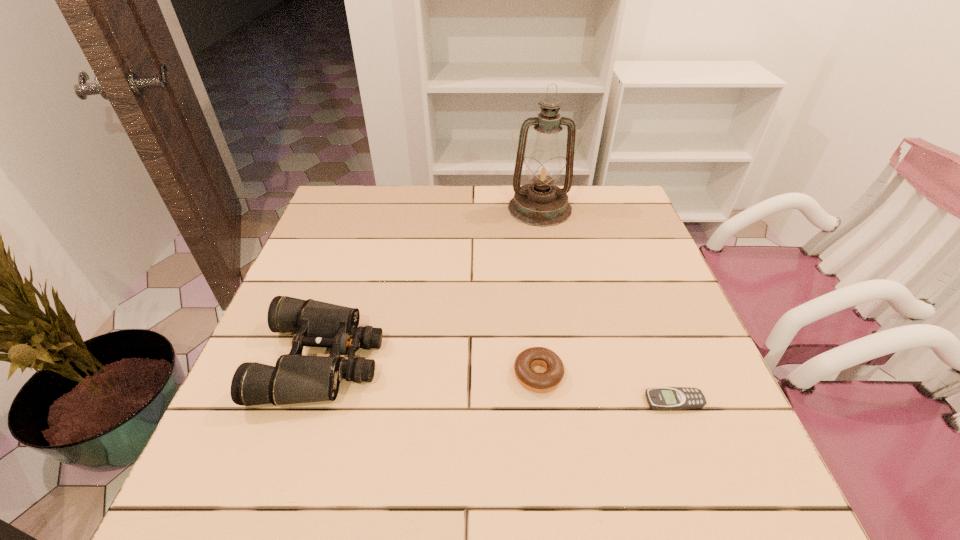
Where is `the tallest object`? This screenshot has height=540, width=960. the tallest object is located at coordinates (540, 203).

This screenshot has height=540, width=960. I want to click on the farthest object, so click(x=540, y=203).

The width and height of the screenshot is (960, 540). I want to click on binoculars, so click(x=296, y=378).

Identify the location of the third shortest object. tap(296, 378).

This screenshot has width=960, height=540. I want to click on the second shortest object, so click(x=537, y=382).

This screenshot has height=540, width=960. Identify the location of the shortest object. (663, 398).

Find the location of a particular element. This screenshot has width=960, height=540. the rightmost object is located at coordinates (663, 398).

Where is `free space located 0.350m on the front of the tallest object`? The height and width of the screenshot is (540, 960). free space located 0.350m on the front of the tallest object is located at coordinates (559, 313).

You are a GUI agent. You are given a task and a screenshot of the screen. Output one action in this format:
    pyautogui.click(x=<x>, y=<y>)
    Task: Click on the blank space located 0.350m through the eyepieces of the binoculars
    
    Given the screenshot: What is the action you would take?
    pyautogui.click(x=543, y=360)

The image size is (960, 540). I want to click on vacant space located 0.330m on the back of the doughnut, so click(524, 258).